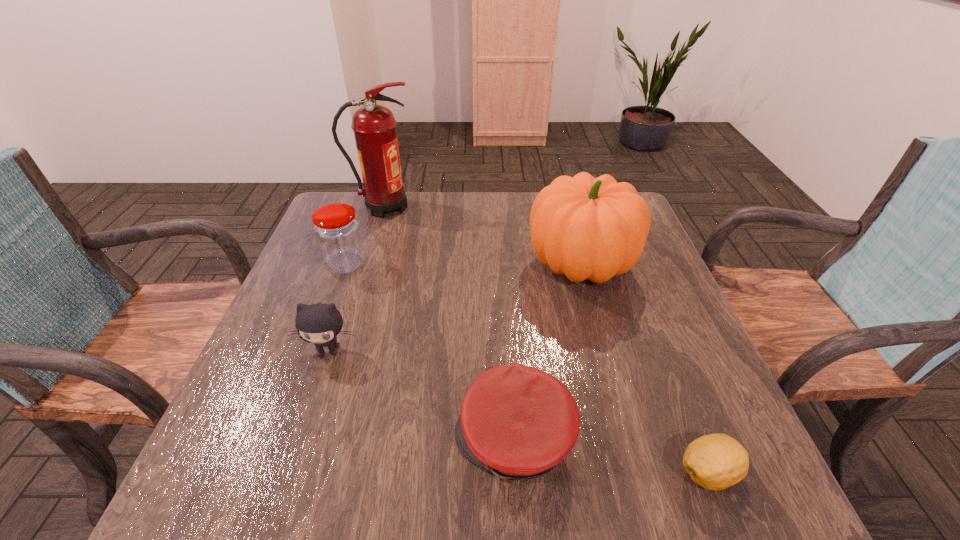
At what (x,y) coordinates should I click in order to perform the action: click on the farthest object. Please return your answer as a coordinate pair (x, y). Image resolution: width=960 pixels, height=540 pixels. Looking at the image, I should click on (374, 126).

Find the location of a particular element. fire extinguisher is located at coordinates (374, 126).

Where is `the fifth shortest object`? The width and height of the screenshot is (960, 540). the fifth shortest object is located at coordinates (591, 228).

Where is `the fourth shortest object`? the fourth shortest object is located at coordinates (337, 230).

Where is `the fourth tallest object`? The image size is (960, 540). the fourth tallest object is located at coordinates (319, 323).

Where is `kitten`? kitten is located at coordinates (319, 323).

Identify the location of the fifth tallest object. [x=518, y=422].

The width and height of the screenshot is (960, 540). What are the coordinates of `lemon` in the screenshot? It's located at (717, 461).

Find the location of `blank area located on the front-facing side of the tallest object`. blank area located on the front-facing side of the tallest object is located at coordinates (511, 207).

Find the location of a particular element. The image size is (960, 540). blank space located on the front of the pumpkin is located at coordinates (612, 377).